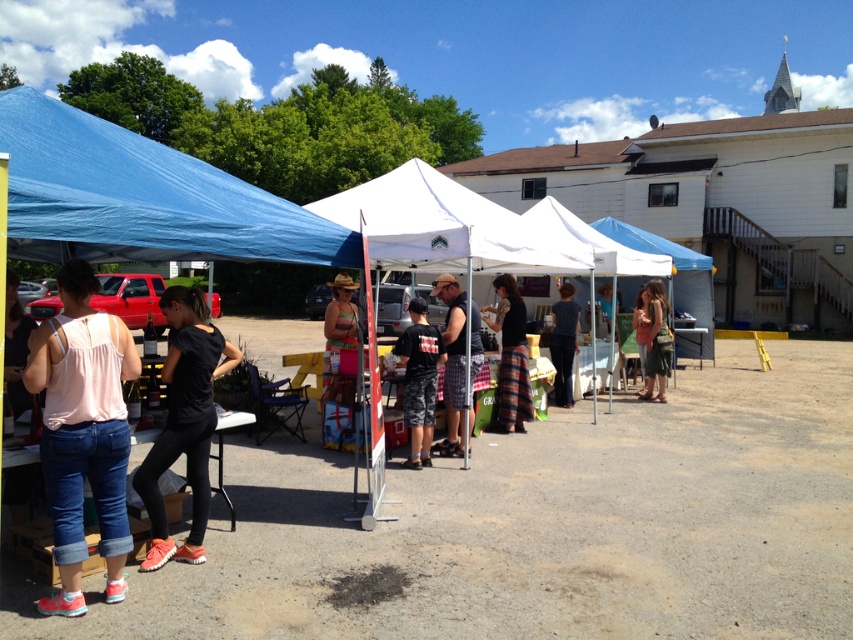
You are a photographer trying to capture both the camouflage shorts at center and the black textured skirt at center in a single frame. Which item will appear larger in your photo?

The camouflage shorts at center will appear larger in the photo since it has a larger size compared to the black textured skirt at center.

You are standing at the point with coordinates (451, 227). Which object are you located at?

You are located at the white fabric tent at center, as the coordinates point (451, 227) represent this object.